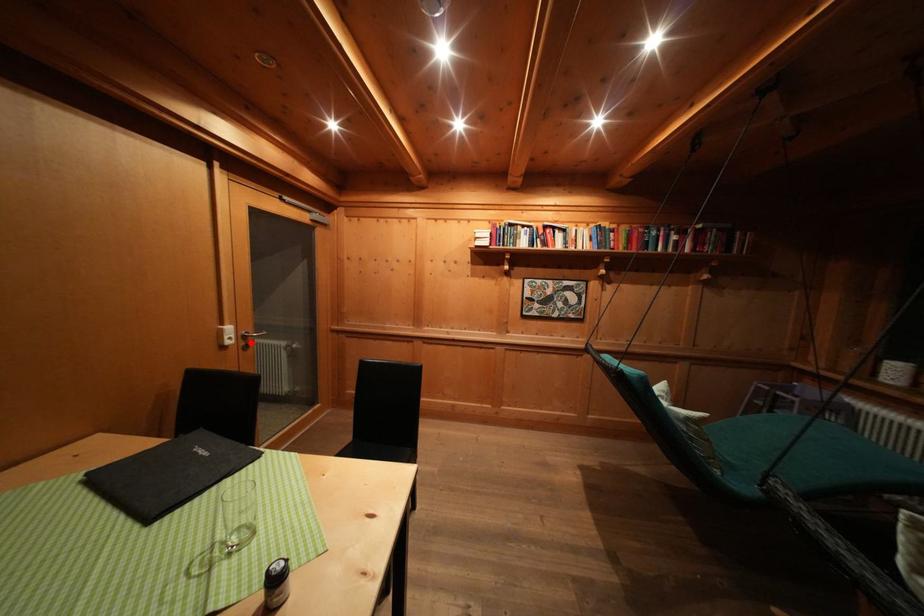
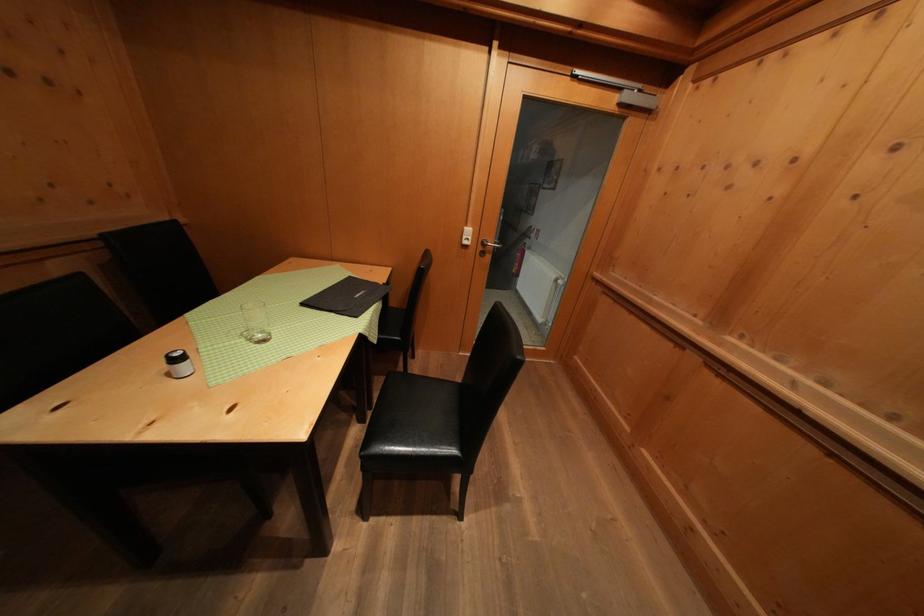
Question: I am providing you with two images of the same scene from different viewpoints. A red point is marked on the first image. Is the red point's position out of view in image 2?

Choices:
 (A) Yes
 (B) No

Answer: (B)